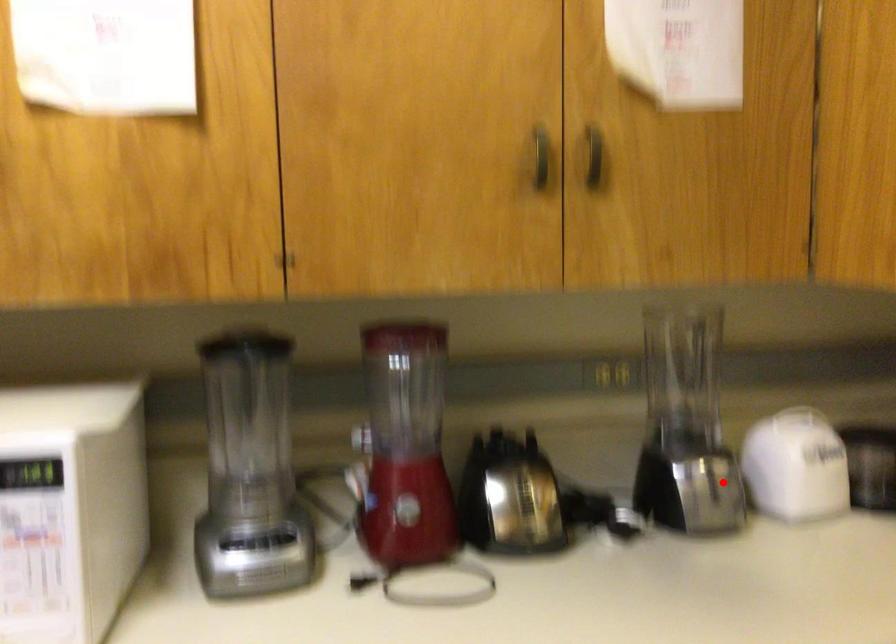
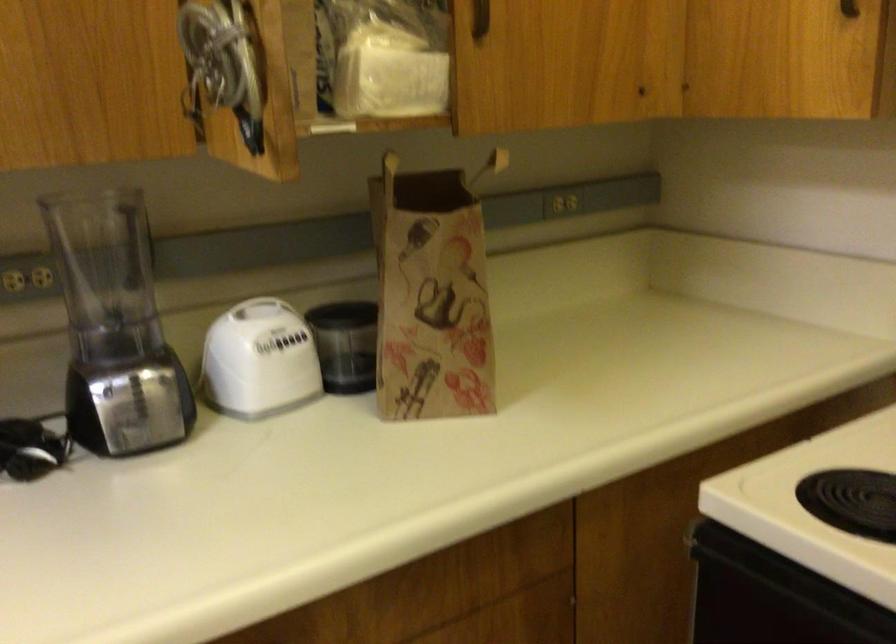
Find the pixel in the second image that matches the highlighted location in the first image.

(149, 395)